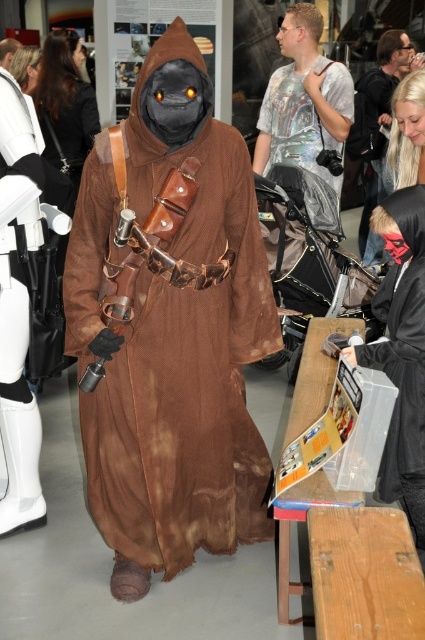
Question: Does brown fabric costume at center come in front of holographic t-shirt at center?

Choices:
 (A) no
 (B) yes

Answer: (B)

Question: Which object is closer to the camera taking this photo?

Choices:
 (A) holographic t-shirt at center
 (B) black matte mask at right
 (C) smooth black mask at upper right

Answer: (B)

Question: Which of the following is the closest to the observer?

Choices:
 (A) (312, 45)
 (B) (416, 236)

Answer: (B)

Question: Which of the following is the farthest from the observer?

Choices:
 (A) brown fabric costume at center
 (B) black matte mask at right
 (C) smooth black mask at upper right
 (D) holographic t-shirt at center

Answer: (C)

Question: Can you confirm if brown fabric costume at center is smaller than holographic t-shirt at center?

Choices:
 (A) no
 (B) yes

Answer: (A)

Question: Does brown fabric costume at center have a greater width compared to holographic t-shirt at center?

Choices:
 (A) yes
 (B) no

Answer: (A)